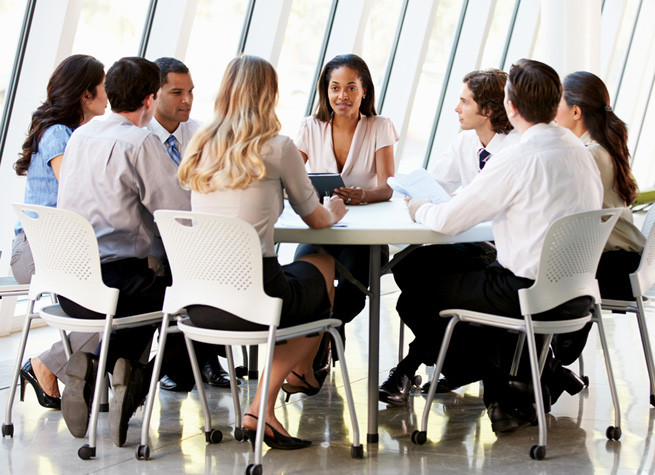
This screenshot has width=655, height=475. In order to click on chairs in this screenshot , I will do `click(572, 268)`, `click(637, 281)`, `click(402, 340)`, `click(219, 282)`, `click(75, 268)`, `click(10, 289)`.